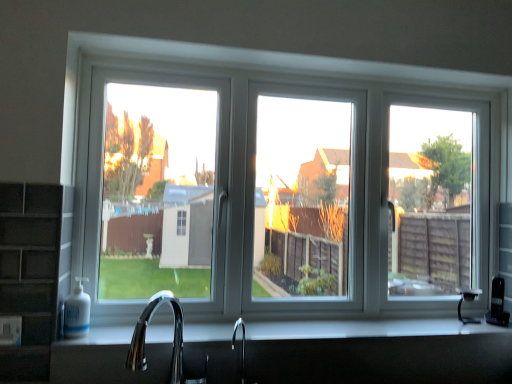
Question: Is chrome metallic faucet at lower center looking in the opposite direction of white glossy countertop at center?

Choices:
 (A) yes
 (B) no

Answer: (B)

Question: Considering the relative positions of chrome metallic faucet at lower center and white glossy countertop at center in the image provided, is chrome metallic faucet at lower center behind white glossy countertop at center?

Choices:
 (A) yes
 (B) no

Answer: (B)

Question: Could you tell me if chrome metallic faucet at lower center is turned towards white glossy countertop at center?

Choices:
 (A) yes
 (B) no

Answer: (B)

Question: Does chrome metallic faucet at lower center have a smaller size compared to white glossy countertop at center?

Choices:
 (A) no
 (B) yes

Answer: (A)

Question: Can you confirm if chrome metallic faucet at lower center is positioned to the right of white glossy countertop at center?

Choices:
 (A) no
 (B) yes

Answer: (A)

Question: From the image's perspective, is chrome metallic faucet at lower center on white glossy countertop at center?

Choices:
 (A) no
 (B) yes

Answer: (B)

Question: From a real-world perspective, is chrome metallic faucet at lower center physically below white plastic window at center?

Choices:
 (A) yes
 (B) no

Answer: (A)

Question: From a real-world perspective, is chrome metallic faucet at lower center on top of white plastic window at center?

Choices:
 (A) yes
 (B) no

Answer: (B)

Question: Does chrome metallic faucet at lower center turn towards white plastic window at center?

Choices:
 (A) no
 (B) yes

Answer: (A)

Question: Is chrome metallic faucet at lower center beside white plastic window at center?

Choices:
 (A) no
 (B) yes

Answer: (A)

Question: Can you confirm if chrome metallic faucet at lower center is wider than white plastic window at center?

Choices:
 (A) no
 (B) yes

Answer: (B)

Question: From the image's perspective, is chrome metallic faucet at lower center below white plastic window at center?

Choices:
 (A) yes
 (B) no

Answer: (A)

Question: Can we say white plastic window at center lies outside chrome metallic faucet at lower center?

Choices:
 (A) no
 (B) yes

Answer: (B)